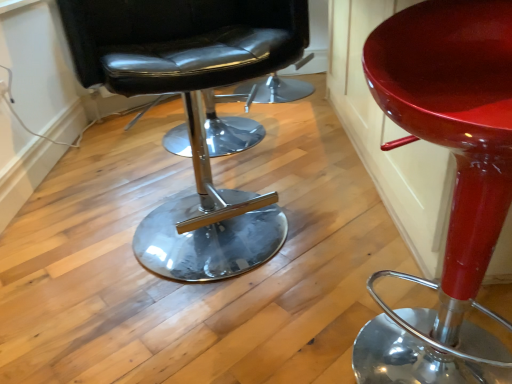
Question: Based on their positions, is black leather chair at center, which is counted as the 1th chair, starting from the left, located to the left or right of glossy red stool at center, placed as the second chair when sorted from left to right?

Choices:
 (A) right
 (B) left

Answer: (B)

Question: From the image's perspective, relative to glossy red stool at center, placed as the second chair when sorted from left to right, is black leather chair at center, placed as the 2th chair when sorted from right to left, above or below?

Choices:
 (A) above
 (B) below

Answer: (A)

Question: Looking at the image, does black leather chair at center, which is counted as the 1th chair, starting from the left, seem bigger or smaller compared to glossy red stool at center, placed as the second chair when sorted from left to right?

Choices:
 (A) small
 (B) big

Answer: (B)

Question: Is glossy red stool at center, placed as the second chair when sorted from left to right, inside the boundaries of black leather chair at center, which is counted as the 1th chair, starting from the left, or outside?

Choices:
 (A) inside
 (B) outside

Answer: (B)

Question: In terms of width, does glossy red stool at center, acting as the 1th chair starting from the right, look wider or thinner when compared to black leather chair at center, which is counted as the 1th chair, starting from the left?

Choices:
 (A) wide
 (B) thin

Answer: (B)

Question: Does point (458, 200) appear closer or farther from the camera than point (234, 79)?

Choices:
 (A) closer
 (B) farther

Answer: (A)

Question: Considering the relative positions of glossy red stool at center, acting as the 1th chair starting from the right, and black leather chair at center, which is counted as the 1th chair, starting from the left, in the image provided, is glossy red stool at center, acting as the 1th chair starting from the right, to the left or to the right of black leather chair at center, which is counted as the 1th chair, starting from the left,?

Choices:
 (A) right
 (B) left

Answer: (A)